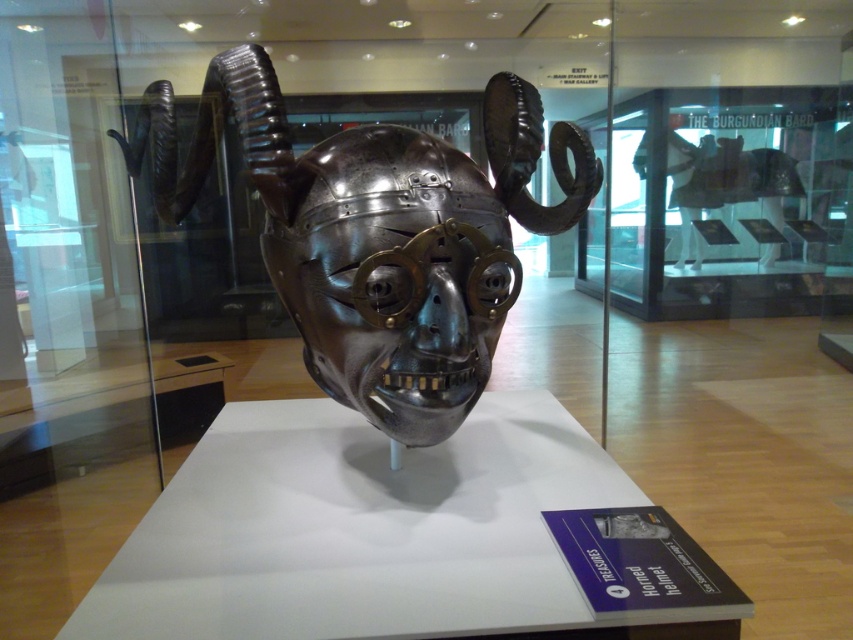
Between polished metal helmet at center and polished metal skull at center, which one has more height?

With more height is polished metal helmet at center.

Which is behind, point (281, 163) or point (351, 336)?

The point (351, 336) is behind.

Image resolution: width=853 pixels, height=640 pixels. I want to click on polished metal helmet at center, so click(378, 234).